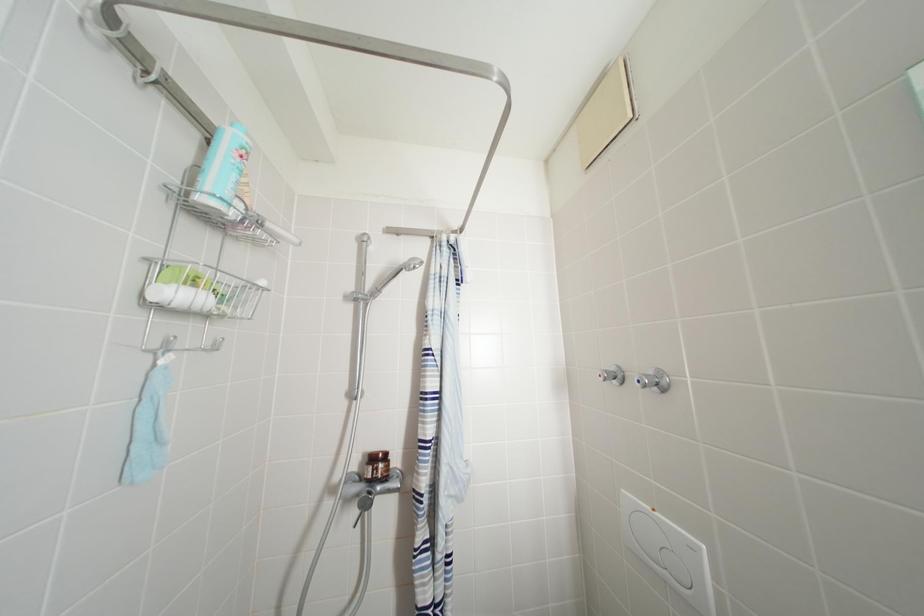
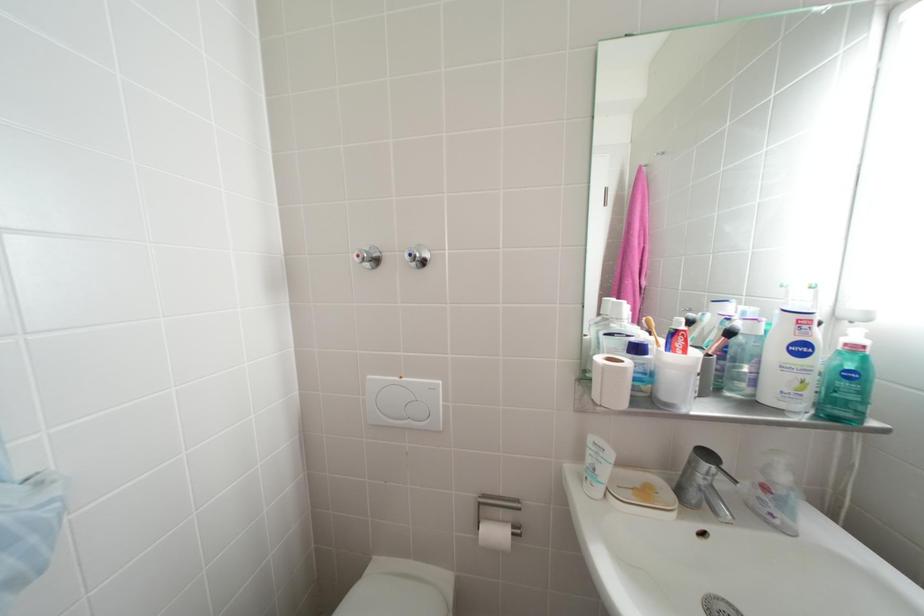
Question: The images are taken continuously from a first-person perspective. In which direction is your viewpoint rotating?

Choices:
 (A) Left
 (B) Right
 (C) Up
 (D) Down

Answer: (B)